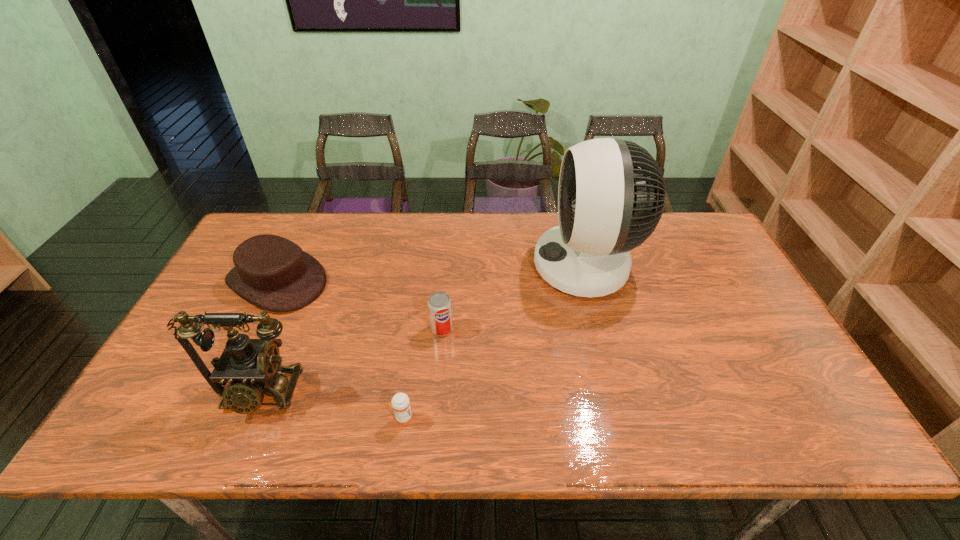
Find the location of a particular element. free space located 0.330m on the grille of the tallest object is located at coordinates (427, 266).

Find the location of a particular element. Image resolution: width=960 pixels, height=540 pixels. vacant space located on the back of the hat is located at coordinates (300, 234).

Find the location of a particular element. Image resolution: width=960 pixels, height=540 pixels. free space located 0.320m on the right of the third farthest object is located at coordinates (572, 329).

The image size is (960, 540). I want to click on vacant space located on the back of the third object from left to right, so (x=409, y=377).

The height and width of the screenshot is (540, 960). What are the coordinates of `fan present at the far edge` in the screenshot? It's located at (611, 195).

The image size is (960, 540). In order to click on hat that is at the far edge in this screenshot , I will do `click(272, 272)`.

In order to click on telephone that is at the near edge in this screenshot , I will do `click(252, 367)`.

Identify the location of medicine that is positioned at the near edge. (400, 403).

Image resolution: width=960 pixels, height=540 pixels. What are the coordinates of `telephone that is at the left edge` in the screenshot? It's located at (252, 367).

Find the location of a particular element. The image size is (960, 540). hat that is at the left edge is located at coordinates (272, 272).